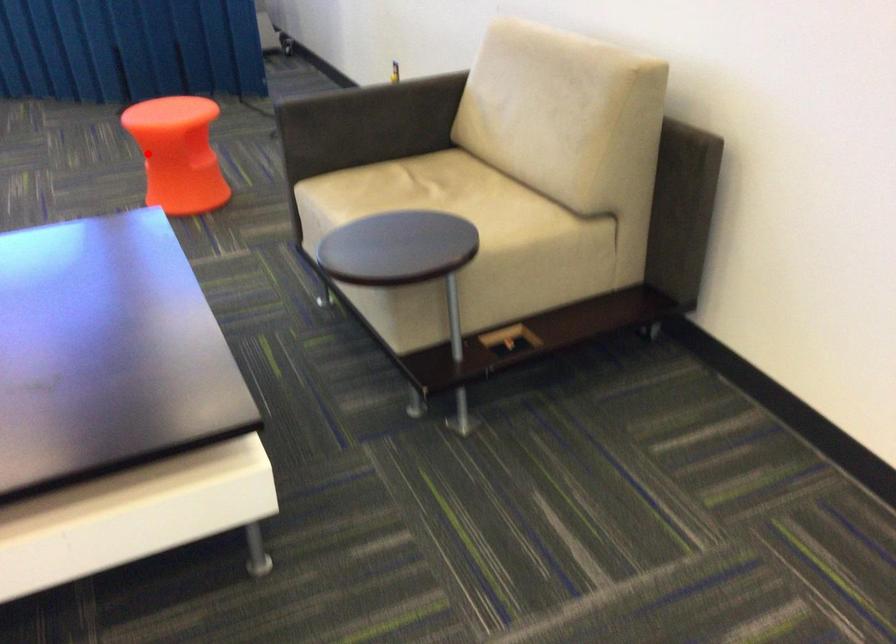
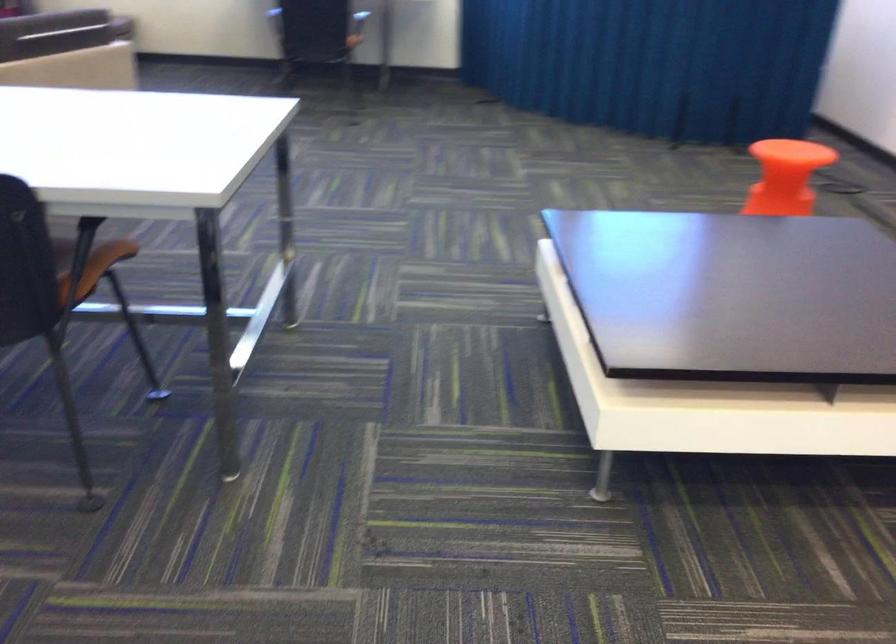
Question: I am providing you with two images of the same scene from different viewpoints. A red point is shown in image1. For the corresponding object point in image2, is it positioned nearer or farther from the camera?

Choices:
 (A) Nearer
 (B) Farther

Answer: (B)